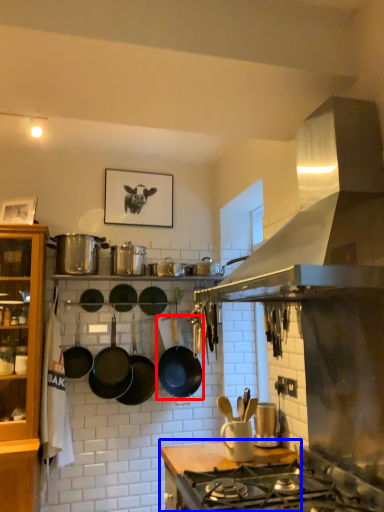
Question: Which object is further to the camera taking this photo, wok (highlighted by a red box) or countertop (highlighted by a blue box)?

Choices:
 (A) wok
 (B) countertop

Answer: (A)